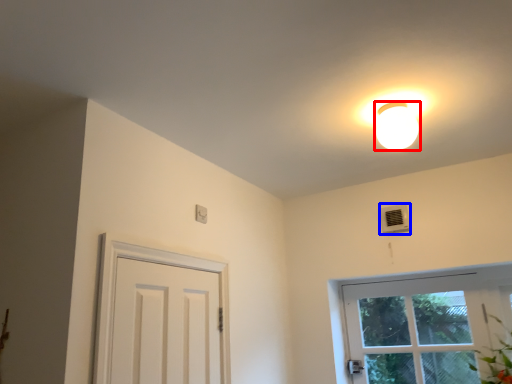
Question: Which of the following is the closest to the observer, lamp (highlighted by a red box) or air conditioner (highlighted by a blue box)?

Choices:
 (A) lamp
 (B) air conditioner

Answer: (A)